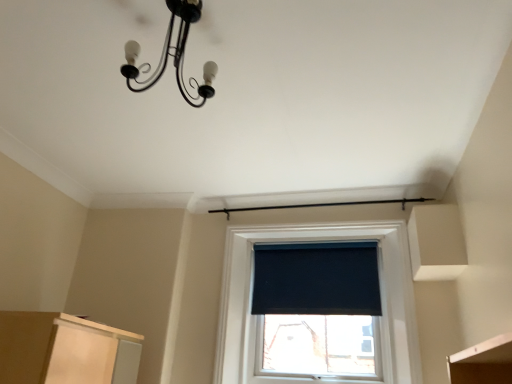
In order to face black matte window screen at center, should I rotate leftwards or rightwards?

You should look right and rotate roughly 7.779 degrees.

What do you see at coordinates (316, 279) in the screenshot? The height and width of the screenshot is (384, 512). I see `black matte window screen at center` at bounding box center [316, 279].

Locate an element on the screen. The width and height of the screenshot is (512, 384). black matte window screen at center is located at coordinates (316, 279).

Where is `black matte chandelier at upper center`? black matte chandelier at upper center is located at coordinates (173, 55).

What do you see at coordinates (173, 55) in the screenshot? This screenshot has width=512, height=384. I see `black matte chandelier at upper center` at bounding box center [173, 55].

The image size is (512, 384). In order to click on black matte window screen at center in this screenshot , I will do coord(316,279).

Which is more to the right, black matte window screen at center or black matte chandelier at upper center?

Positioned to the right is black matte window screen at center.

In the image, is black matte window screen at center positioned in front of or behind black matte chandelier at upper center?

black matte window screen at center is behind black matte chandelier at upper center.

Which is farther, [269,283] or [135,52]?

Positioned behind is point [269,283].

From the image's perspective, is black matte window screen at center on black matte chandelier at upper center?

No.

Based on the photo, from a real-world perspective, which object stands above the other?

From a 3D spatial view, black matte chandelier at upper center is above.

Does black matte window screen at center have a greater width compared to black matte chandelier at upper center?

No, black matte window screen at center is not wider than black matte chandelier at upper center.

Between black matte window screen at center and black matte chandelier at upper center, which one has less height?

black matte chandelier at upper center is shorter.

Based on their sizes in the image, would you say black matte window screen at center is bigger or smaller than black matte chandelier at upper center?

Considering their sizes, black matte window screen at center takes up less space than black matte chandelier at upper center.

Is black matte window screen at center located outside black matte chandelier at upper center?

Absolutely, black matte window screen at center is external to black matte chandelier at upper center.

Based on the photo, can you see black matte window screen at center touching black matte chandelier at upper center?

No, black matte window screen at center is not touching black matte chandelier at upper center.

Consider the image. Could you tell me if black matte window screen at center is facing black matte chandelier at upper center?

Yes, black matte window screen at center faces towards black matte chandelier at upper center.

Based on the photo, can you tell me how much black matte window screen at center and black matte chandelier at upper center differ in facing direction?

0.416 degrees.

I want to click on lamp on the left of black matte window screen at center, so click(173, 55).

Considering the relative positions of black matte chandelier at upper center and black matte window screen at center in the image provided, is black matte chandelier at upper center to the right of black matte window screen at center from the viewer's perspective?

No, black matte chandelier at upper center is not to the right of black matte window screen at center.

Considering the positions of objects black matte chandelier at upper center and black matte window screen at center in the image provided, who is behind, black matte chandelier at upper center or black matte window screen at center?

black matte window screen at center is behind.

Is point (166, 55) closer to camera compared to point (341, 273)?

Yes, it is in front of point (341, 273).

From the image's perspective, which one is positioned lower, black matte chandelier at upper center or black matte window screen at center?

black matte window screen at center.

From a real-world perspective, relative to black matte window screen at center, is black matte chandelier at upper center vertically above or below?

In terms of real-world spatial position, black matte chandelier at upper center is above black matte window screen at center.

Considering the sizes of objects black matte chandelier at upper center and black matte window screen at center in the image provided, who is wider, black matte chandelier at upper center or black matte window screen at center?

black matte chandelier at upper center is wider.

In terms of height, does black matte chandelier at upper center look taller or shorter compared to black matte window screen at center?

In the image, black matte chandelier at upper center appears to be shorter than black matte window screen at center.

Does black matte chandelier at upper center have a smaller size compared to black matte window screen at center?

No, black matte chandelier at upper center is not smaller than black matte window screen at center.

Is black matte window screen at center surrounded by black matte chandelier at upper center?

No.

Is black matte chandelier at upper center directly adjacent to black matte window screen at center?

No.

Is black matte chandelier at upper center looking in the opposite direction of black matte window screen at center?

That's right, black matte chandelier at upper center is facing away from black matte window screen at center.

How many degrees apart are the facing directions of black matte chandelier at upper center and black matte window screen at center?

The facing directions of black matte chandelier at upper center and black matte window screen at center are 0.416 degrees apart.

Locate an element on the screen. The height and width of the screenshot is (384, 512). lamp in front of the black matte window screen at center is located at coordinates (173, 55).

Locate an element on the screen. lamp that is in front of the black matte window screen at center is located at coordinates (173, 55).

The width and height of the screenshot is (512, 384). I want to click on window screen below the black matte chandelier at upper center (from a real-world perspective), so click(x=316, y=279).